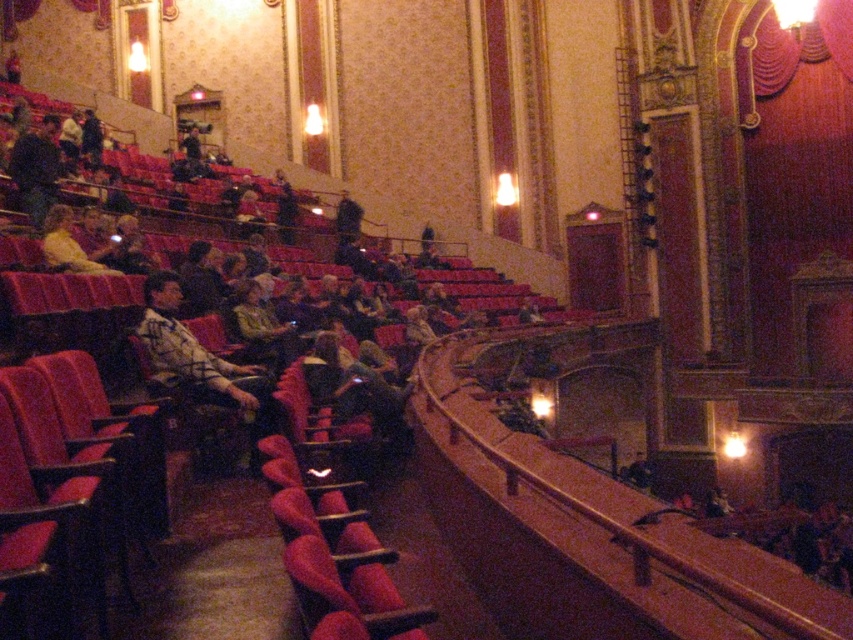
Question: Which object appears farthest from the camera in this image?

Choices:
 (A) leather jacket at center
 (B) plaid shirt at center

Answer: (A)

Question: Where is plaid shirt at center located in relation to leather jacket at center in the image?

Choices:
 (A) below
 (B) above

Answer: (A)

Question: Can you confirm if plaid shirt at center is positioned to the right of leather jacket at center?

Choices:
 (A) yes
 (B) no

Answer: (A)

Question: Can you confirm if plaid shirt at center is positioned above leather jacket at center?

Choices:
 (A) yes
 (B) no

Answer: (B)